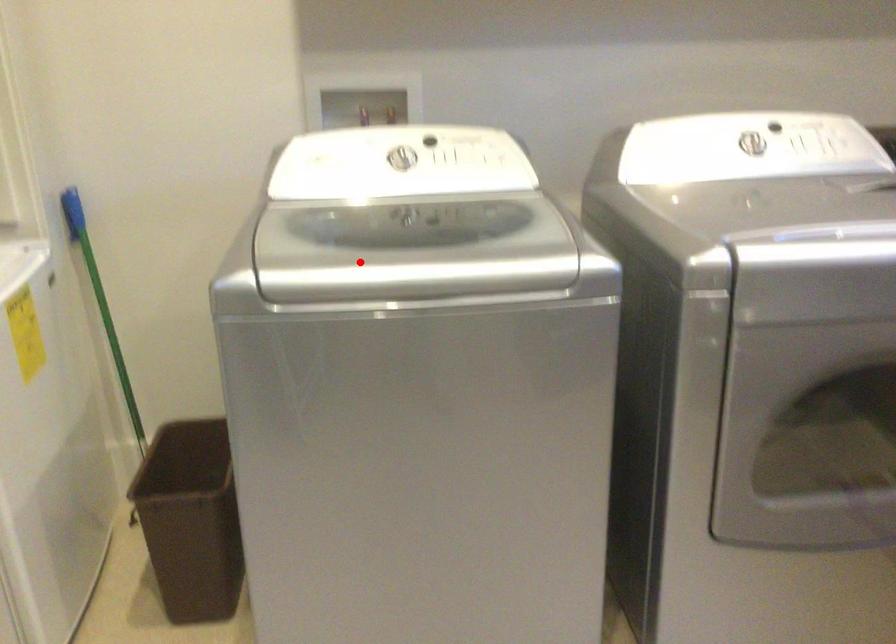
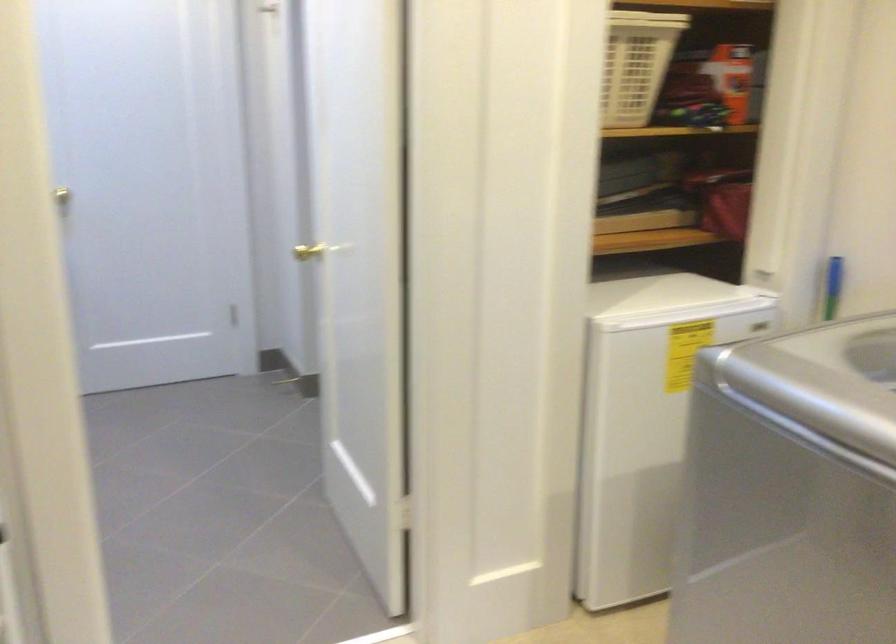
In the second image, find the point that corresponds to the highlighted location in the first image.

(823, 380)